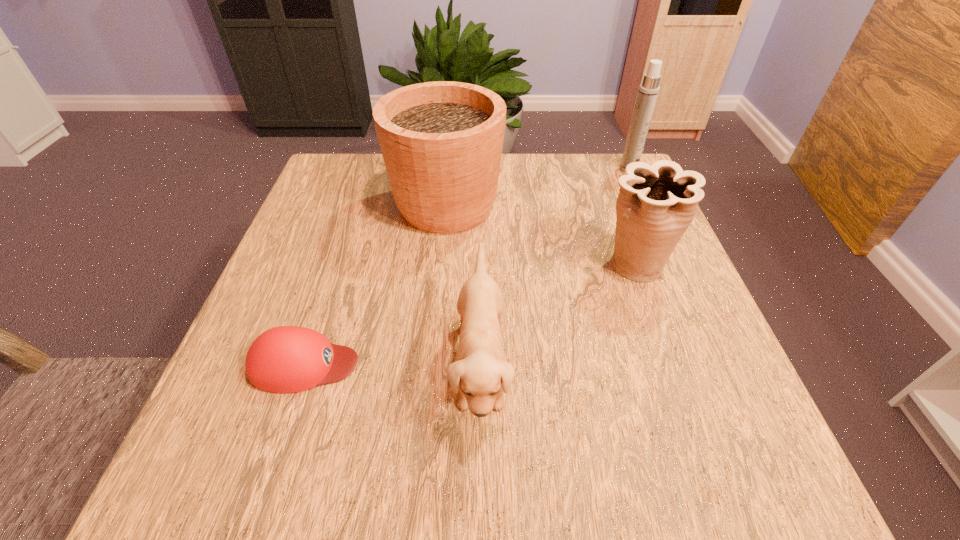
At what (x,y) coordinates should I click in order to perform the action: click on aerosol can. Please return your answer as a coordinate pair (x, y). The image size is (960, 540). Looking at the image, I should click on (648, 91).

Where is `flowerpot`? The height and width of the screenshot is (540, 960). flowerpot is located at coordinates (x=441, y=142).

You are a GUI agent. You are given a task and a screenshot of the screen. Output one action in this format:
    pyautogui.click(x=<x>, y=<y>)
    Task: Click on the third nearest object
    The height and width of the screenshot is (540, 960).
    Given the screenshot: What is the action you would take?
    pyautogui.click(x=656, y=203)

You are a GUI agent. You are given a task and a screenshot of the screen. Output one action in this format:
    pyautogui.click(x=<x>, y=<y>)
    Task: Click on the urn
    
    Given the screenshot: What is the action you would take?
    pyautogui.click(x=656, y=203)

Find the location of a particular element. This screenshot has width=960, height=540. the second shortest object is located at coordinates (480, 374).

Locate an element on the screen. the shortest object is located at coordinates (288, 359).

Locate an element on the screen. The image size is (960, 540). vacant area situated 0.120m on the left of the farthest object is located at coordinates (574, 169).

Identify the location of vacant space located on the front of the flowerpot. The width and height of the screenshot is (960, 540). (439, 285).

Where is `free spot located 0.240m on the front of the third nearest object`? The width and height of the screenshot is (960, 540). free spot located 0.240m on the front of the third nearest object is located at coordinates (684, 402).

Image resolution: width=960 pixels, height=540 pixels. I want to click on vacant space located on the left side of the second shortest object, so click(x=232, y=366).